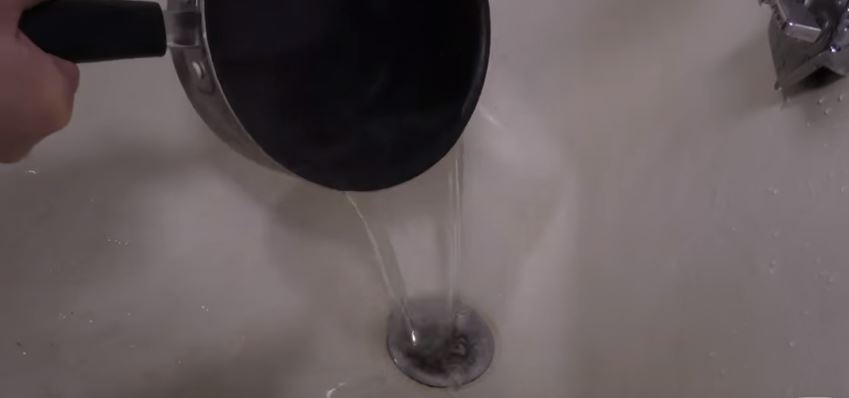
Locate an element on the screen. pot handle is located at coordinates (104, 37).